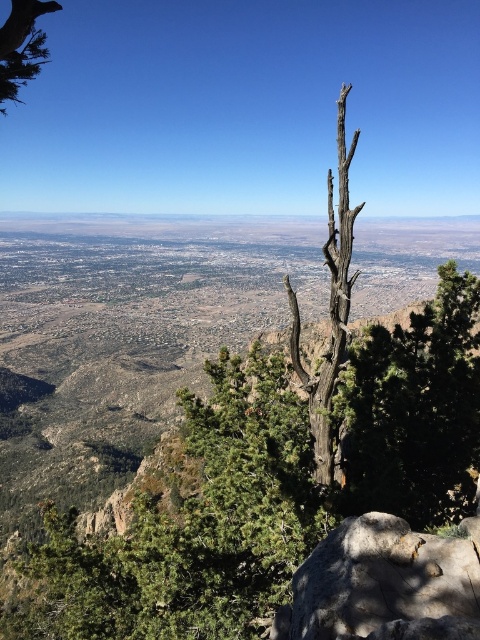
Question: Can you confirm if dark brown bark tree at center is positioned to the right of gray rough rock at lower right?

Choices:
 (A) no
 (B) yes

Answer: (A)

Question: Does dark brown bark tree at center have a greater width compared to gray rough rock at lower right?

Choices:
 (A) no
 (B) yes

Answer: (B)

Question: Which object is the farthest from the green matte tree at upper left?

Choices:
 (A) gray rough rock at lower right
 (B) charcoal textured tree trunk at center
 (C) dark brown bark tree at center

Answer: (C)

Question: Which point is closer to the camera?

Choices:
 (A) dark brown bark tree at center
 (B) charcoal textured tree trunk at center
 (C) green matte tree at upper left
 (D) gray rough rock at lower right

Answer: (D)

Question: Is gray rough rock at lower right above green matte tree at upper left?

Choices:
 (A) no
 (B) yes

Answer: (A)

Question: Which point is closer to the camera?

Choices:
 (A) (333, 609)
 (B) (384, 336)

Answer: (A)